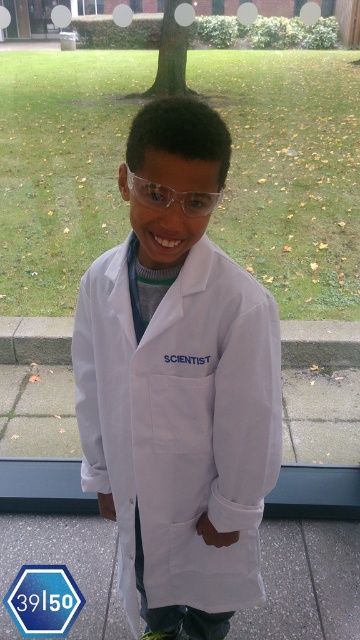
You are a photographer trying to capture the scientist in the scene. You notice two points in the image at coordinates point (96, 326) and point (185, 196). Which point is closer to your camera lens?

Point (96, 326) is further to the viewer than point (185, 196). Therefore, point (96, 326) is closer to the camera lens.

You are a photographer trying to capture the white matte lab coat at center in a portrait. Based on the scene, where should you position the camera to ensure the lab coat is centered in the frame?

The white matte lab coat at center is positioned at point (180, 422), so you should aim the camera at those coordinates to center it in the frame.

You are a scientist who needs to reach an object that is 60 centimeters away from you. You are currently wearing the white matte lab coat at center and the transparent plastic goggles at center. Which item can you reach without moving your position?

The white matte lab coat at center is 57.18 centimeters away from transparent plastic goggles at center. Since the goggles are within the 60 cm range, you can reach the transparent plastic goggles at center without moving.